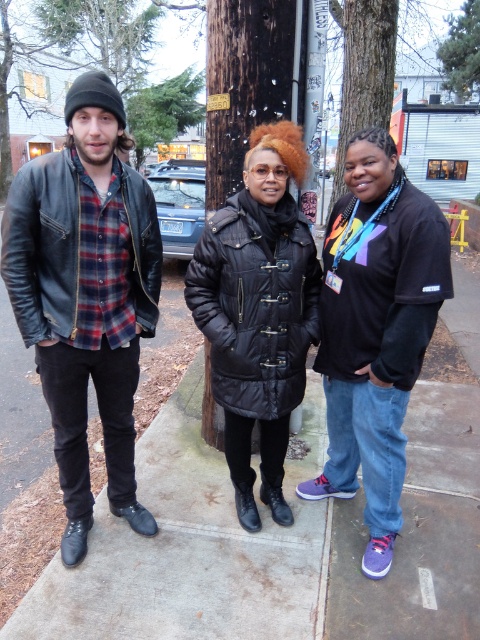
Question: Is black matte t-shirt at center to the right of black quilted coat at center from the viewer's perspective?

Choices:
 (A) yes
 (B) no

Answer: (A)

Question: Which of the following is the farthest from the observer?

Choices:
 (A) black quilted coat at center
 (B) leather jacket at left
 (C) black matte t-shirt at center

Answer: (A)

Question: Can you confirm if leather jacket at left is positioned to the left of black quilted coat at center?

Choices:
 (A) no
 (B) yes

Answer: (B)

Question: Which object is the farthest from the black matte t-shirt at center?

Choices:
 (A) leather jacket at left
 (B) black quilted coat at center

Answer: (A)

Question: Does leather jacket at left appear on the left side of black quilted coat at center?

Choices:
 (A) yes
 (B) no

Answer: (A)

Question: Which object is closer to the camera taking this photo?

Choices:
 (A) black matte t-shirt at center
 (B) black quilted coat at center
 (C) leather jacket at left

Answer: (C)